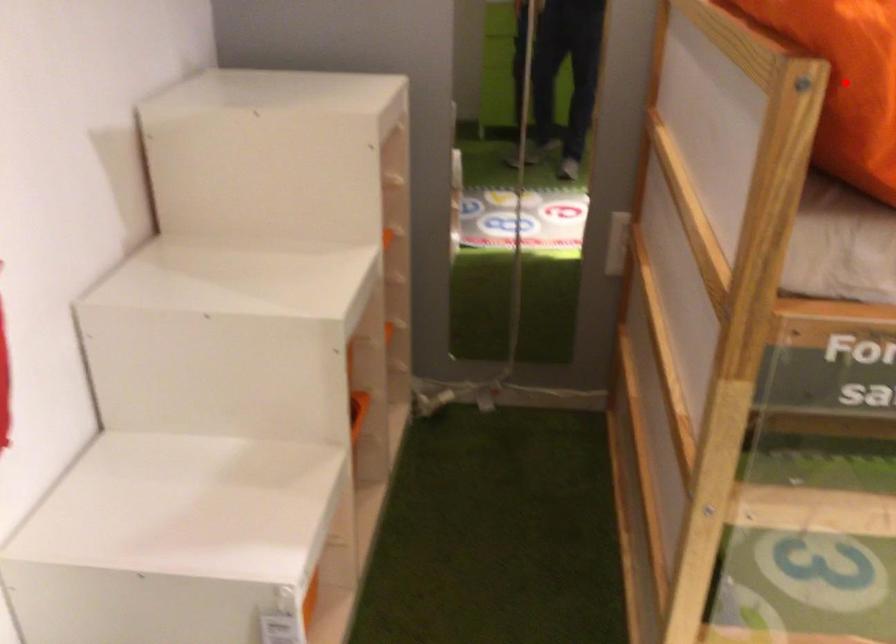
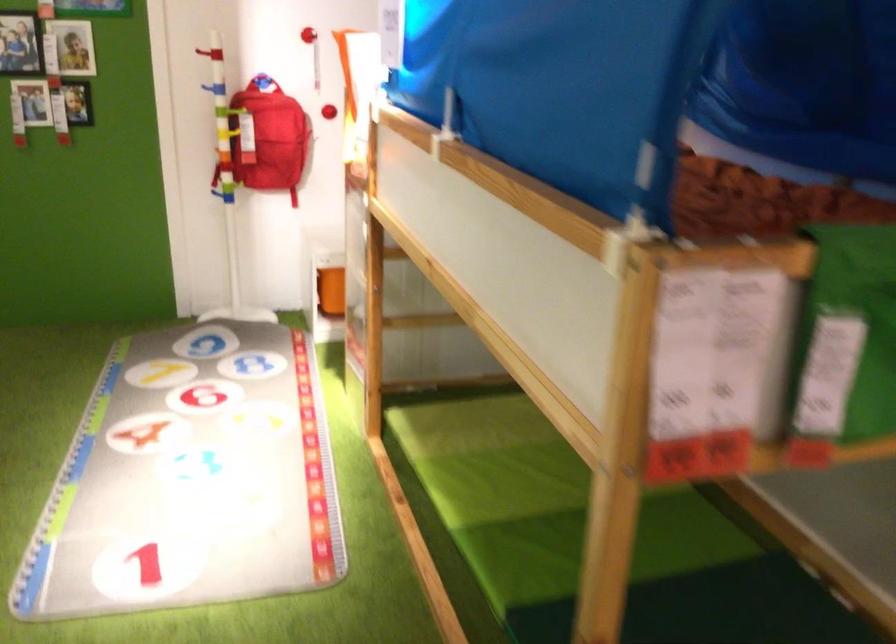
Question: I am providing you with two images of the same scene from different viewpoints. A red point is marked on the first image. At the location where the point appears in image 1, is it still visible in image 2?

Choices:
 (A) Yes
 (B) No

Answer: (B)